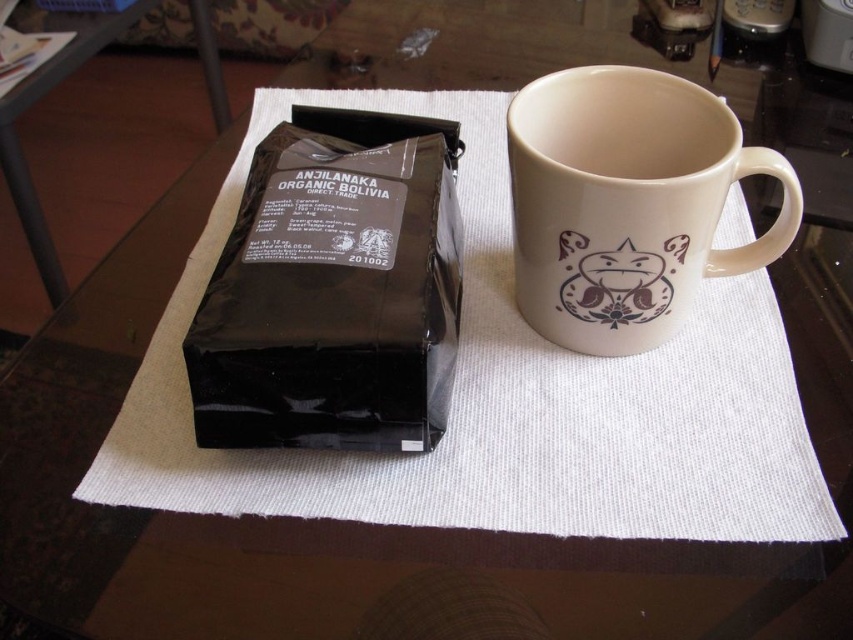
In the scene shown: Can you confirm if black matte bag at left is shorter than matte ceramic mug at upper right?

In fact, black matte bag at left may be taller than matte ceramic mug at upper right.

Can you confirm if black matte bag at left is wider than matte ceramic mug at upper right?

In fact, black matte bag at left might be narrower than matte ceramic mug at upper right.

Image resolution: width=853 pixels, height=640 pixels. What do you see at coordinates (334, 289) in the screenshot?
I see `black matte bag at left` at bounding box center [334, 289].

Identify the location of black matte bag at left. This screenshot has width=853, height=640. (334, 289).